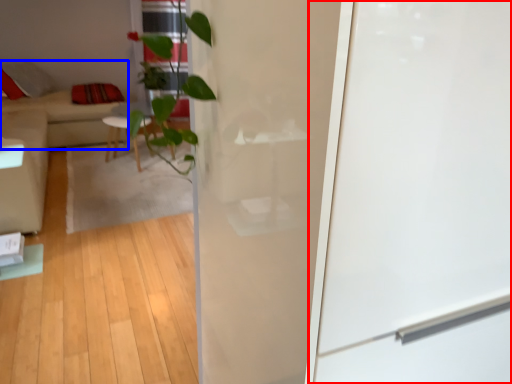
Question: Among these objects, which one is farthest to the camera, screen door (highlighted by a red box) or couch (highlighted by a blue box)?

Choices:
 (A) screen door
 (B) couch

Answer: (B)